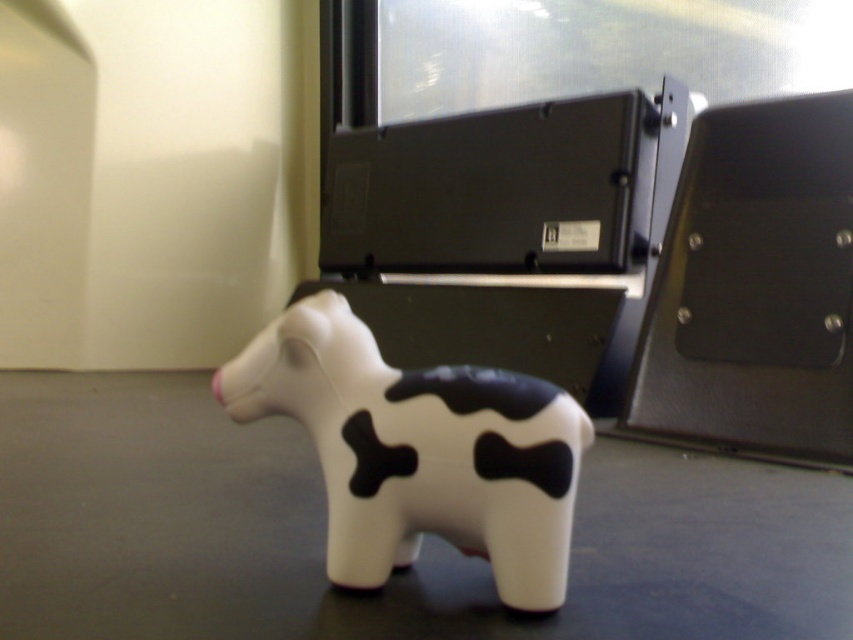
You are organizing a science fair exhibit and need to place the white matte cow at lower center and the metallic silver dot at center right on a display table. The table has limited space. Based on their sizes, which object should you place first to ensure both fit properly?

The white matte cow at lower center is bigger than the metallic silver dot at center right, so you should place the white matte cow at lower center first to ensure both fit properly.

You are looking at the image and want to determine which of the two points, point (325, 420) or point (701, 243), is nearer to you. Based on the spatial arrangement in the scene, which point is closer?

Point (325, 420) is closer to the viewer than point (701, 243).

You are organizing a small science fair exhibit and have both the white matte cow at lower center and the metallic dot at center right on display. Since space is limited, you need to know which object takes up more area on the table. Which one is bigger?

The white matte cow at lower center is larger in size compared to the metallic dot at center right, so it takes up more area on the table.